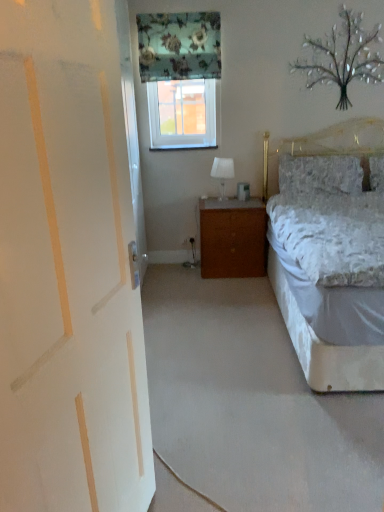
Find the location of a particular element. This screenshot has width=384, height=512. free point above floral fabric curtain at upper center (from a real-world perspective) is located at coordinates (170, 5).